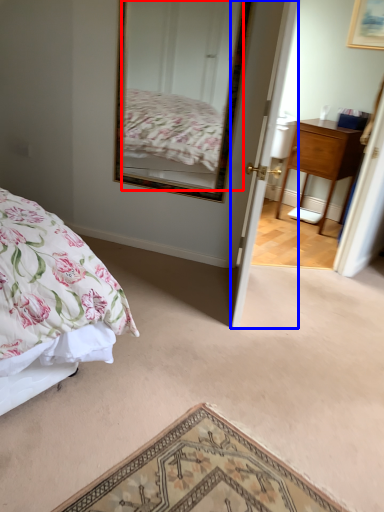
Question: Which of the following is the farthest to the observer, mirror (highlighted by a red box) or door (highlighted by a blue box)?

Choices:
 (A) mirror
 (B) door

Answer: (A)